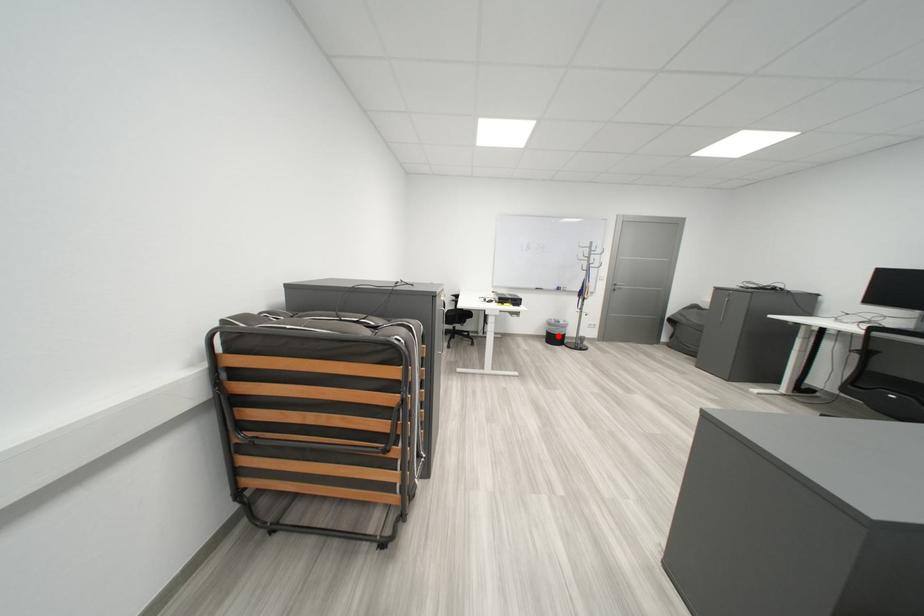
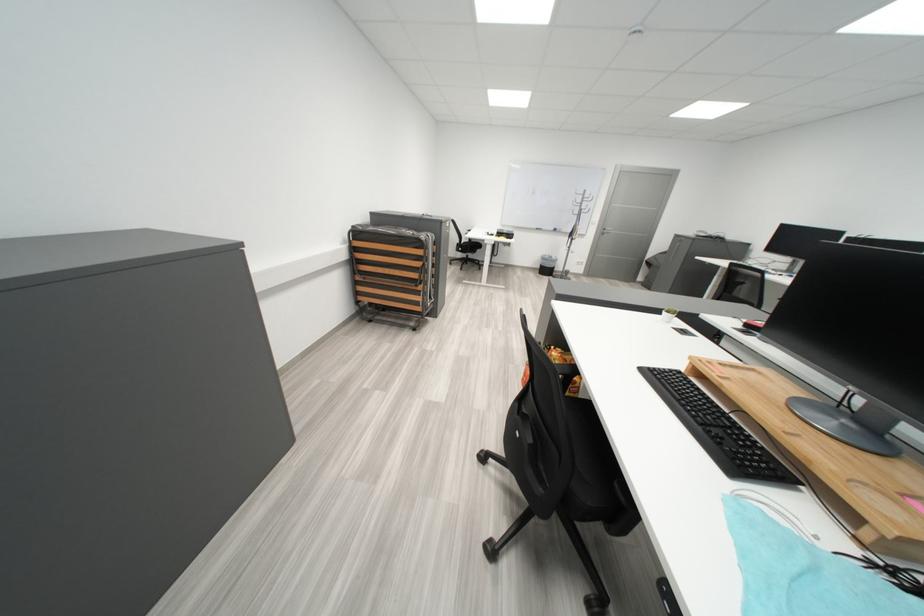
Question: I am providing you with two images of the same scene from different viewpoints. A red point is shown in image1. For the corresponding object point in image2, is it positioned nearer or farther from the camera?

Choices:
 (A) Nearer
 (B) Farther

Answer: (A)